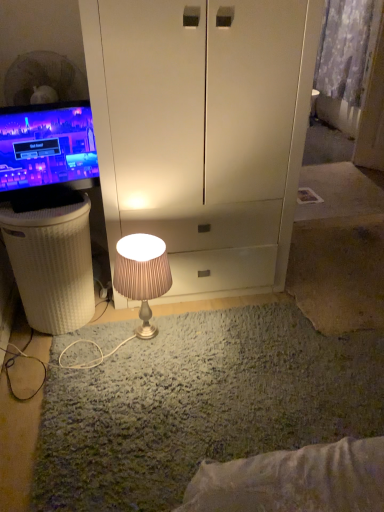
Question: Is matte black monitor at left oriented towards white wicker basket at left?

Choices:
 (A) no
 (B) yes

Answer: (A)

Question: Is matte black monitor at left thinner than white wicker basket at left?

Choices:
 (A) yes
 (B) no

Answer: (A)

Question: Is matte black monitor at left far from white wicker basket at left?

Choices:
 (A) yes
 (B) no

Answer: (B)

Question: Can you confirm if matte black monitor at left is bigger than white wicker basket at left?

Choices:
 (A) no
 (B) yes

Answer: (A)

Question: Is matte black monitor at left closer to the viewer compared to white wicker basket at left?

Choices:
 (A) yes
 (B) no

Answer: (A)

Question: From the image's perspective, is white wicker basket at left positioned above or below matte black monitor at left?

Choices:
 (A) below
 (B) above

Answer: (A)

Question: Based on their sizes in the image, would you say white wicker basket at left is bigger or smaller than matte black monitor at left?

Choices:
 (A) big
 (B) small

Answer: (A)

Question: Considering the positions of white wicker basket at left and matte black monitor at left in the image, is white wicker basket at left taller or shorter than matte black monitor at left?

Choices:
 (A) tall
 (B) short

Answer: (A)

Question: In the image, is white wicker basket at left positioned in front of or behind matte black monitor at left?

Choices:
 (A) front
 (B) behind

Answer: (B)

Question: Is patterned fabric curtain at upper right to the left or to the right of matte black monitor at left in the image?

Choices:
 (A) right
 (B) left

Answer: (A)

Question: Is patterned fabric curtain at upper right wider or thinner than matte black monitor at left?

Choices:
 (A) thin
 (B) wide

Answer: (B)

Question: Is point (354, 26) closer or farther from the camera than point (23, 119)?

Choices:
 (A) closer
 (B) farther

Answer: (B)

Question: From the image's perspective, relative to matte black monitor at left, is patterned fabric curtain at upper right above or below?

Choices:
 (A) below
 (B) above

Answer: (B)

Question: In terms of size, does satin beige lamp at center appear bigger or smaller than patterned fabric curtain at upper right?

Choices:
 (A) small
 (B) big

Answer: (A)

Question: Is satin beige lamp at center situated inside patterned fabric curtain at upper right or outside?

Choices:
 (A) outside
 (B) inside

Answer: (A)